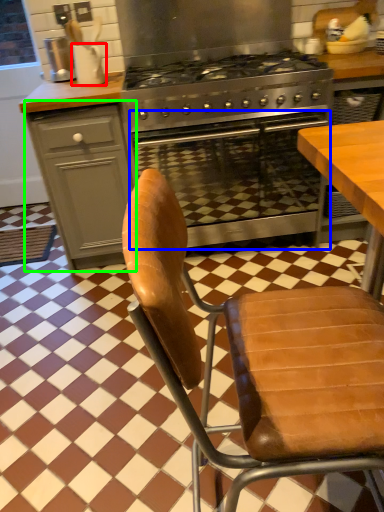
Question: Estimate the real-world distances between objects in this image. Which object is farther from kitchen appliance (highlighted by a red box), oven (highlighted by a blue box) or cabinetry (highlighted by a green box)?

Choices:
 (A) oven
 (B) cabinetry

Answer: (A)